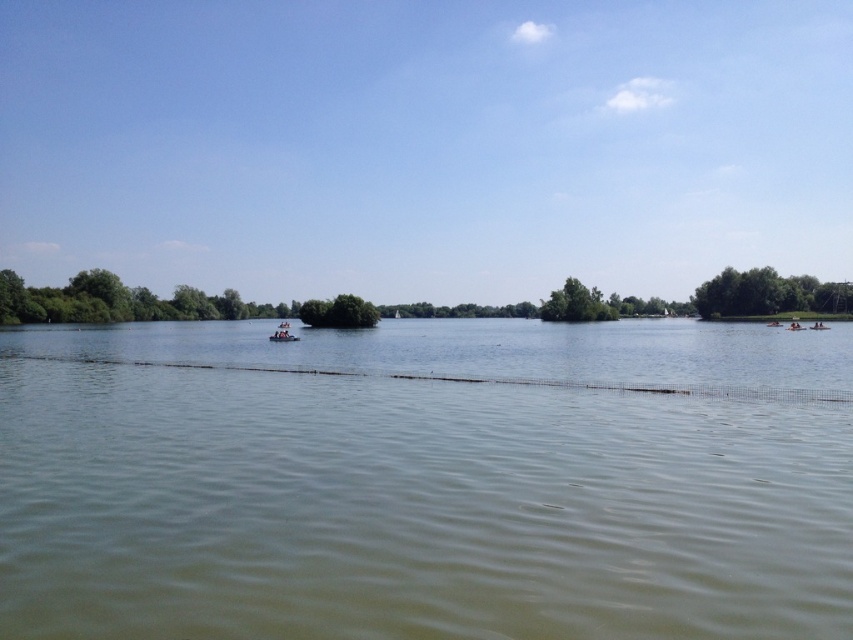
You are standing on the wooden raft at center and want to look at the green leafy trees at right. In which direction should you look to see them?

The green leafy trees at right are located above the wooden raft at center, so you should look upwards to see them.

You are standing at the lakeside and looking at two points in the scene. The first point is labeled as point [105,365] and the second is point [341,307]. Which point is closer to your current position?

Point [105,365] is closer to the camera than point [341,307], so it is closer to your current position.

You are standing at the lakeside and want to throw a stone into the water. The green murky water at center is your target. If your throwing range is 7 meters, will you be able to reach it?

Answer: The green murky water at center is 7.29 meters from the viewer. Since your throwing range is 7 meters, you cannot reach it.